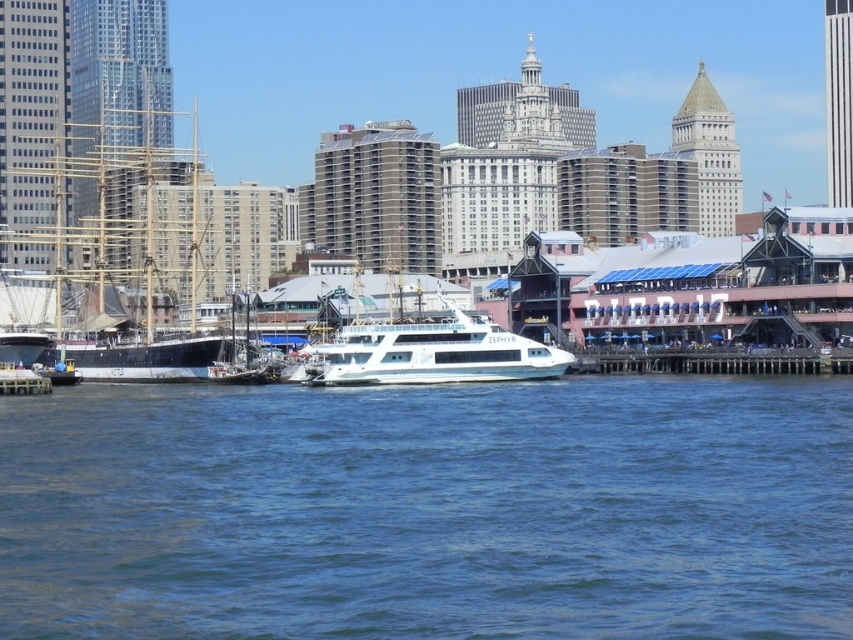
Is point (625, 403) closer to viewer compared to point (518, 342)?

Yes.

In order to click on blue liquid water at lower center in this screenshot , I will do `click(430, 509)`.

Where is `blue liquid water at lower center`? blue liquid water at lower center is located at coordinates (430, 509).

Is blue liquid water at lower center smaller than wooden ship at left?

Yes, blue liquid water at lower center is smaller than wooden ship at left.

Based on the photo, can you confirm if blue liquid water at lower center is positioned to the right of wooden ship at left?

Correct, you'll find blue liquid water at lower center to the right of wooden ship at left.

The height and width of the screenshot is (640, 853). I want to click on blue liquid water at lower center, so click(x=430, y=509).

This screenshot has width=853, height=640. Find the location of `blue liquid water at lower center`. blue liquid water at lower center is located at coordinates (430, 509).

Which of these two, wooden ship at left or white glossy ferry at center, stands shorter?

With less height is white glossy ferry at center.

Is wooden ship at left positioned in front of white glossy ferry at center?

No.

Between point (170, 352) and point (502, 376), which one is positioned in front?

Point (502, 376)

Identify the location of wooden ship at left. (149, 246).